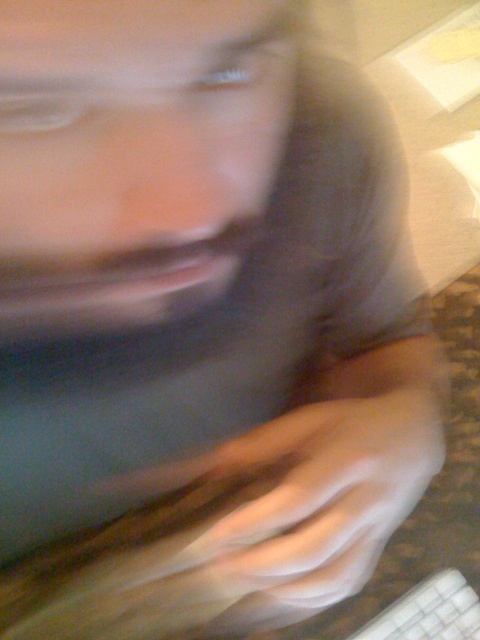
You are a delivery robot trying to reach the desk in the scene. The point at point [328,540] is the location of the desk. Your current position is at point 0.0, 0.0. The distance between these two points is 14.80 inches. Can you safely navigate to the desk without any obstacles?

The distance between your current position at point 0.0, 0.0 and the desk at point [328,540] is 14.80 inches. Since there are no obstacles mentioned in the scene description, you can safely navigate to the desk.

You are a virtual assistant trying to guide someone to place their hand on a specific spot on the desk. The smooth skin hand at center is currently at point 0.766, 0.690. If the desk coordinates are from 0 to 1 in both x and y, where should the person move their hand to reach the target at point 0.5, 0.5?

The smooth skin hand at center is currently at point (331, 490). To reach the target at (240, 320), the person should move their hand slightly to the left and down since the current position is to the right and above the target point.